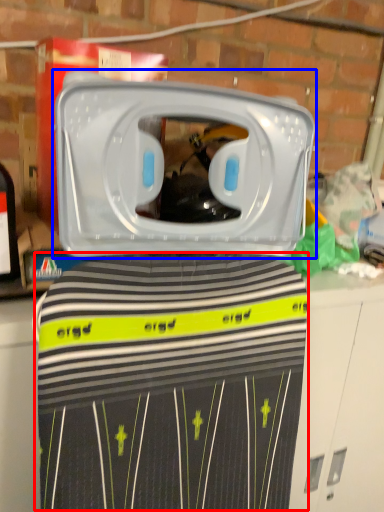
Question: Which of the following is the farthest to the observer, clothing (highlighted by a red box) or home appliance (highlighted by a blue box)?

Choices:
 (A) clothing
 (B) home appliance

Answer: (A)